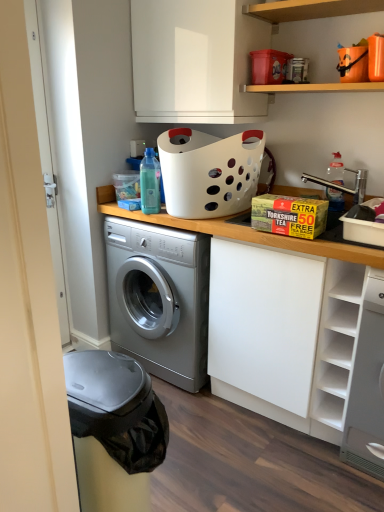
Question: Is point (34, 266) positioned closer to the camera than point (261, 242)?

Choices:
 (A) farther
 (B) closer

Answer: (B)

Question: Considering their positions, is white smooth door at left located in front of or behind white matte cabinet at center?

Choices:
 (A) front
 (B) behind

Answer: (B)

Question: Estimate the real-world distances between objects in this image. Which object is closer to the white glossy cabinet at upper center?

Choices:
 (A) white matte cabinet at center
 (B) white plastic basket at upper center
 (C) white smooth door at left
 (D) white matte shelf at right, positioned as the 2th shelf in top-to-bottom order
 (E) transparent plastic bottle at center, the second bottle viewed from the right

Answer: (B)

Question: Which is farther from the transparent plastic bottle at center, the second bottle viewed from the right?

Choices:
 (A) white matte shelf at right, acting as the 1th shelf starting from the bottom
 (B) white plastic basket at upper center
 (C) clear plastic bottle at upper right, placed as the 2th bottle when sorted from left to right
 (D) white matte cabinet at center
 (E) white smooth door at left

Answer: (E)